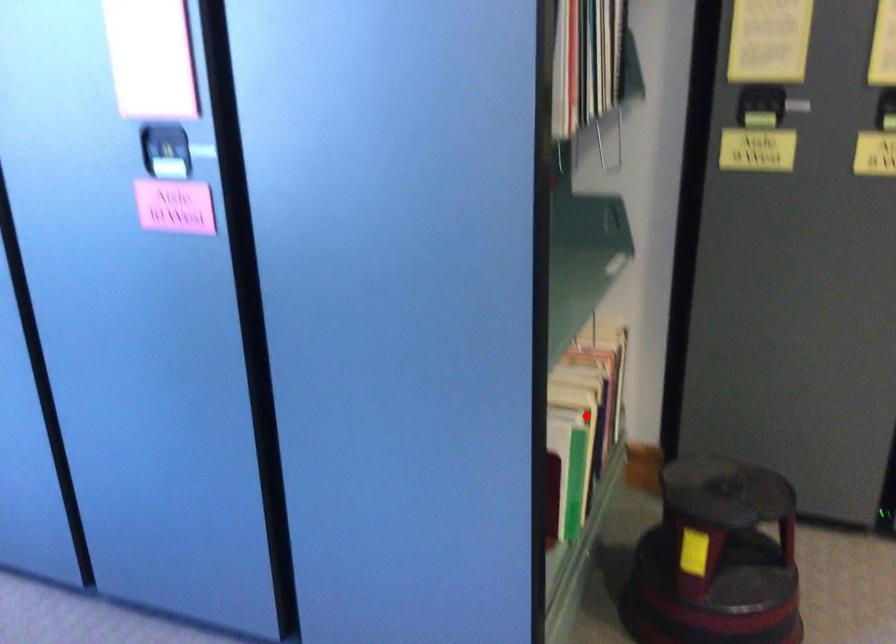
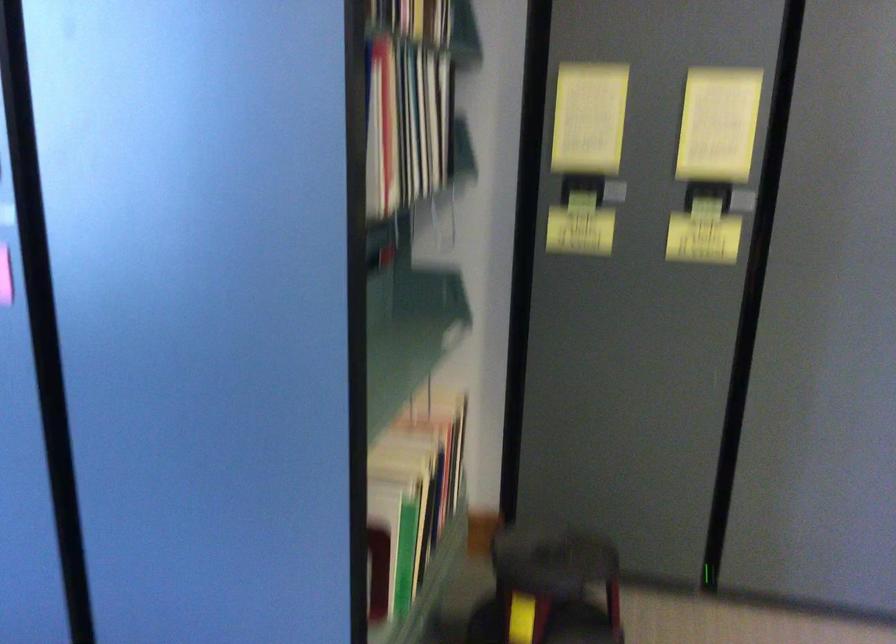
In the second image, find the point that corresponds to the highlighted location in the first image.

(416, 489)